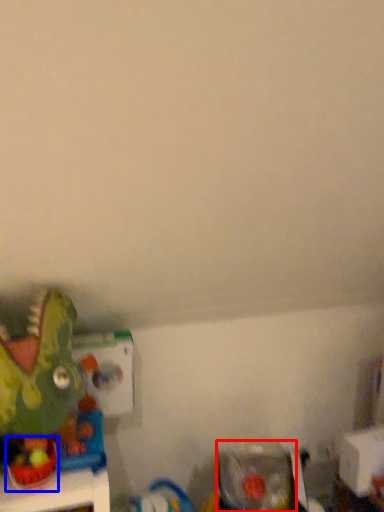
Question: Which point is closer to the camera, toy (highlighted by a red box) or toy (highlighted by a blue box)?

Choices:
 (A) toy
 (B) toy

Answer: (B)